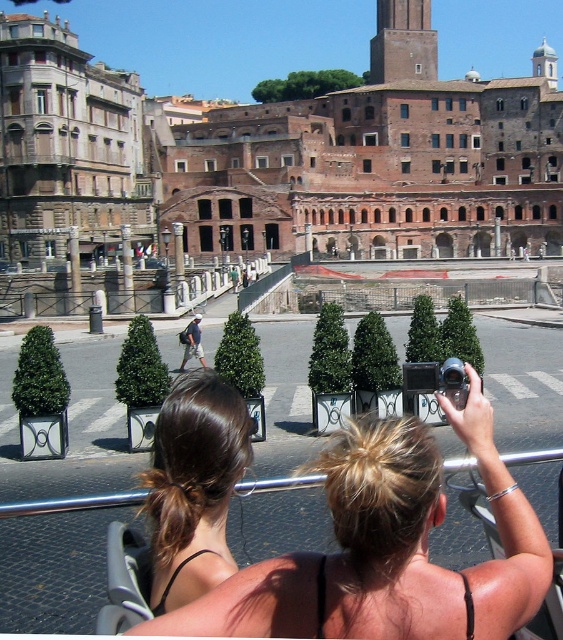
Can you confirm if reddish-brown stone amphitheater at center is positioned below denim shorts at center?

No, reddish-brown stone amphitheater at center is not below denim shorts at center.

Can you confirm if reddish-brown stone amphitheater at center is positioned to the right of denim shorts at center?

Indeed, reddish-brown stone amphitheater at center is positioned on the right side of denim shorts at center.

Who is more forward, (233, 244) or (185, 336)?

Point (185, 336) is in front.

Where is `reddish-brown stone amphitheater at center`? This screenshot has height=640, width=563. reddish-brown stone amphitheater at center is located at coordinates (378, 161).

Can you confirm if reddish-brown stone amphitheater at center is positioned to the right of blonde hair at upper center?

Indeed, reddish-brown stone amphitheater at center is positioned on the right side of blonde hair at upper center.

Is reddish-brown stone amphitheater at center wider than blonde hair at upper center?

Indeed, reddish-brown stone amphitheater at center has a greater width compared to blonde hair at upper center.

You are a GUI agent. You are given a task and a screenshot of the screen. Output one action in this format:
    pyautogui.click(x=<x>, y=<y>)
    Task: Click on the reddish-brown stone amphitheater at center
    
    Given the screenshot: What is the action you would take?
    pyautogui.click(x=378, y=161)

Is blonde hair at upper center to the left of denim shorts at center from the viewer's perspective?

In fact, blonde hair at upper center is to the right of denim shorts at center.

Find the location of a particular element. blonde hair at upper center is located at coordinates (387, 548).